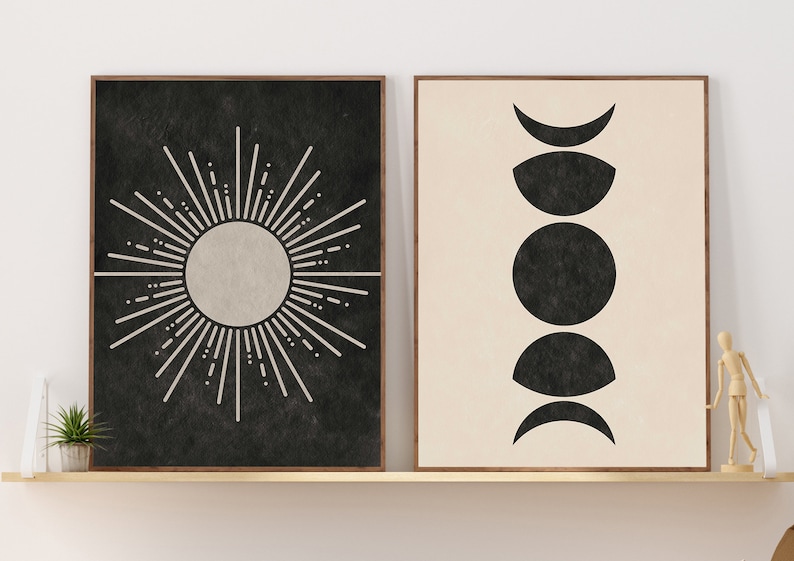
The width and height of the screenshot is (794, 561). Find the location of `shelf bracket`. shelf bracket is located at coordinates (37, 415), (765, 436).